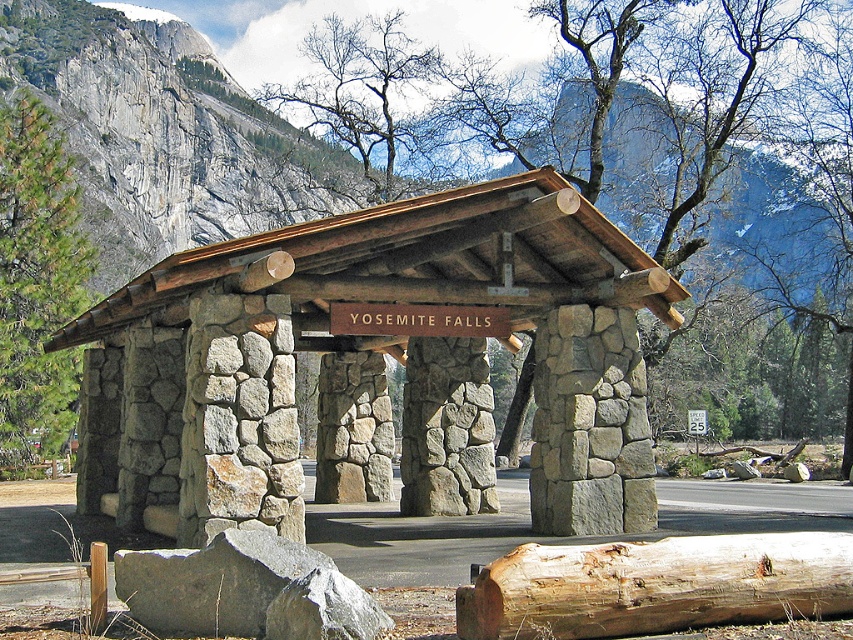
You are standing in front of the rustic stone shelter at Yosemite Falls. You notice two points marked on the structure. The first point is at coordinate point(x=555, y=632) and the second is at point(x=430, y=161). Which of these two points is nearer to your current position?

Point(x=555, y=632) is closer to the camera than point(x=430, y=161), so the first point is nearer to your current position.

You are standing in front of the rustic stone shelter and notice the green pine tree at left and the bare branches at upper center. Which one is positioned more to the left side of the shelter?

The green pine tree at left is positioned more to the left side of the shelter than the bare branches at upper center.